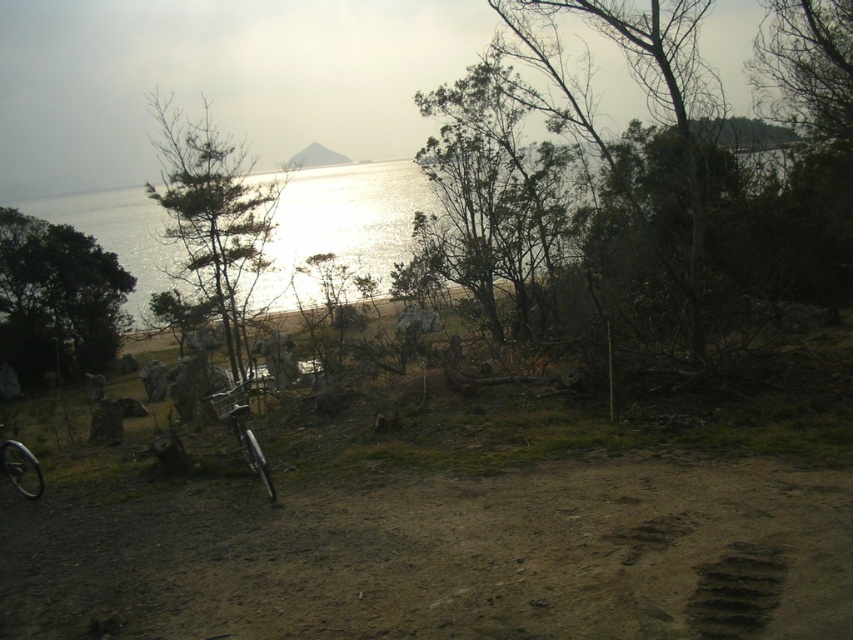
Question: Does green matte tree at center appear over brown dirt footprint at lower center?

Choices:
 (A) yes
 (B) no

Answer: (A)

Question: Does metallic silver bicycle at center have a larger size compared to shiny metallic bicycle wheel at lower left?

Choices:
 (A) yes
 (B) no

Answer: (A)

Question: Which object is farther from the camera taking this photo?

Choices:
 (A) green matte tree at left
 (B) brown dirt field at center
 (C) green leafy tree at center
 (D) shiny metallic bicycle wheel at lower left

Answer: (A)

Question: Among these objects, which one is nearest to the camera?

Choices:
 (A) shiny metallic bicycle wheel at lower left
 (B) green matte tree at center
 (C) green leafy tree at center

Answer: (A)

Question: Is brown dirt footprint at lower center to the left of shiny metallic bicycle wheel at lower left from the viewer's perspective?

Choices:
 (A) yes
 (B) no

Answer: (B)

Question: Which object is positioned farthest from the shiny metallic bicycle wheel at lower left?

Choices:
 (A) green matte tree at center
 (B) brown dirt field at center

Answer: (A)